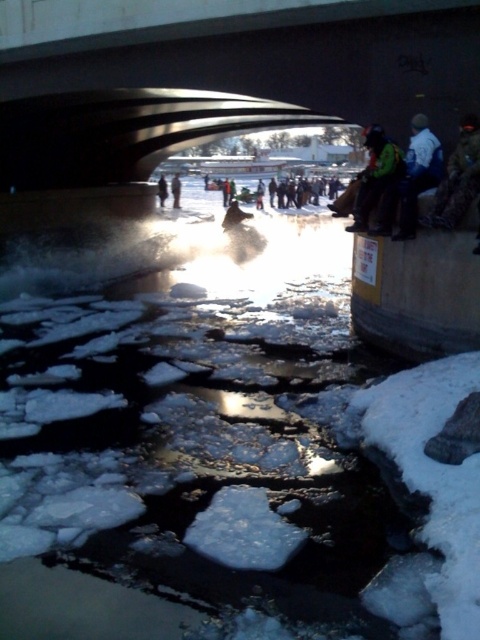
You are standing on the bridge and see the point marked at coordinates (377, 182). What object is located at that point?

The point at (377, 182) marks the green fabric jacket at right.

You are standing under the bridge and want to find the dark blue jacket at upper right. According to the coordinates given, where should you look relative to the image?

The dark blue jacket at upper right is located at point coordinates 0.272 along the horizontal axis and 0.871 along the vertical axis, so you should look towards the upper right area of the image near the coordinates specified.